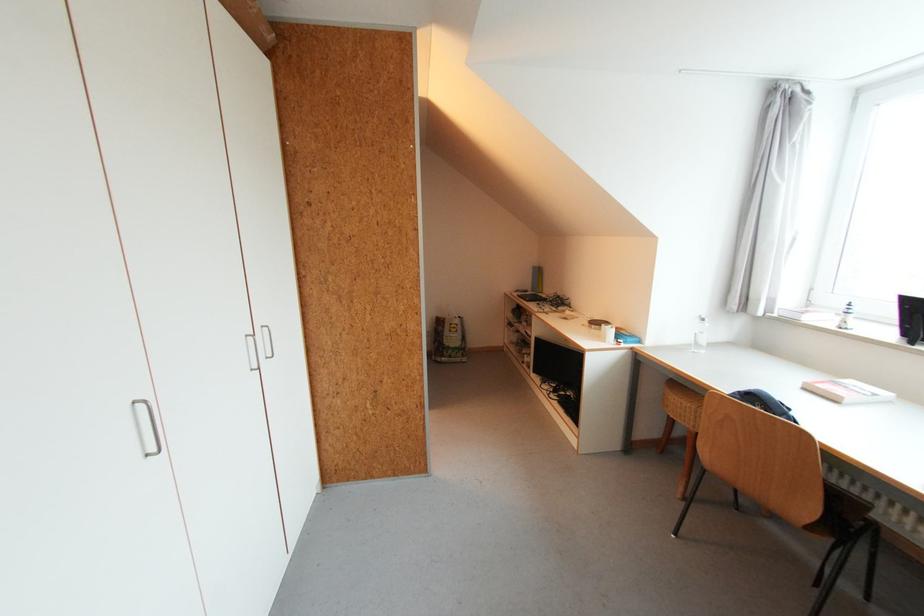
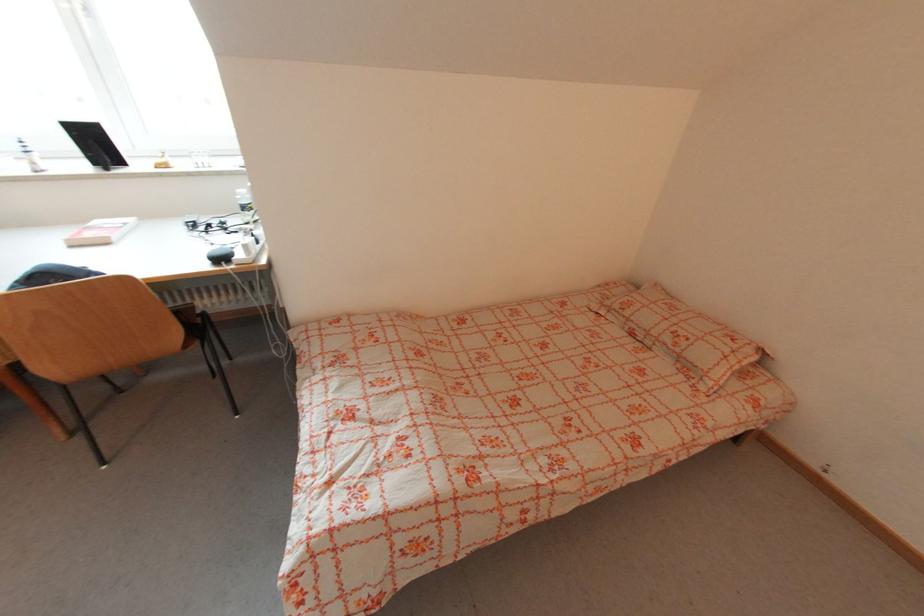
Based on the continuous images, in which direction is the camera rotating?

The camera's rotation is toward right-down.